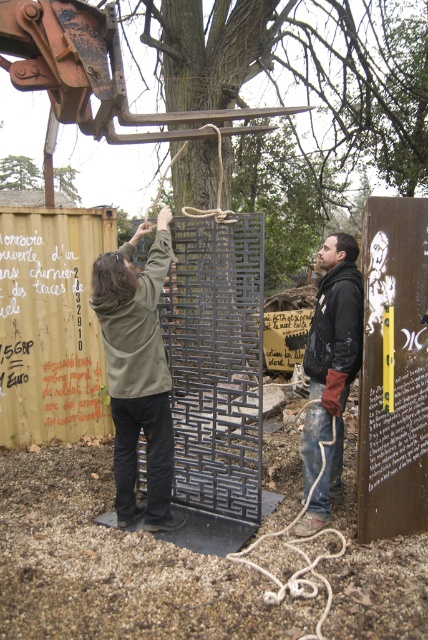
You are a safety inspector at the construction site. You notice two workers in the scene, the green matte hoodie at center and the dark brown leather jacket at right. Which worker is standing at a higher elevation compared to the other?

The green matte hoodie at center is much taller than dark brown leather jacket at right, so the worker in the green matte hoodie at center is standing at a higher elevation.